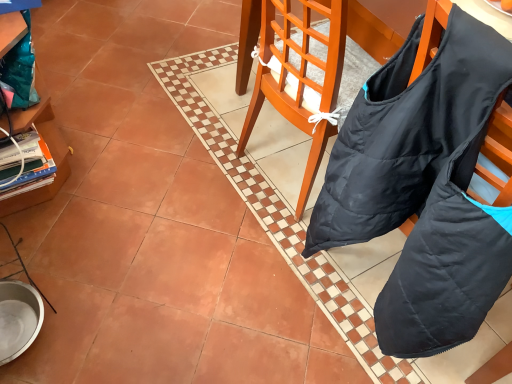
Question: From the image's perspective, is wooden cabinet at left above or below black fabric bag at center?

Choices:
 (A) below
 (B) above

Answer: (B)

Question: Is point (13, 200) positioned closer to the camera than point (279, 8)?

Choices:
 (A) farther
 (B) closer

Answer: (A)

Question: In terms of size, does wooden cabinet at left appear bigger or smaller than black fabric bag at center?

Choices:
 (A) big
 (B) small

Answer: (A)

Question: From the image's perspective, relative to wooden cabinet at left, is black fabric bag at center above or below?

Choices:
 (A) above
 (B) below

Answer: (B)

Question: Considering the positions of black fabric bag at center and wooden cabinet at left in the image, is black fabric bag at center bigger or smaller than wooden cabinet at left?

Choices:
 (A) big
 (B) small

Answer: (B)

Question: Considering the relative positions of black fabric bag at center and wooden cabinet at left in the image provided, is black fabric bag at center to the left or to the right of wooden cabinet at left?

Choices:
 (A) left
 (B) right

Answer: (B)

Question: From a real-world perspective, is black fabric bag at center physically located above or below wooden cabinet at left?

Choices:
 (A) above
 (B) below

Answer: (A)